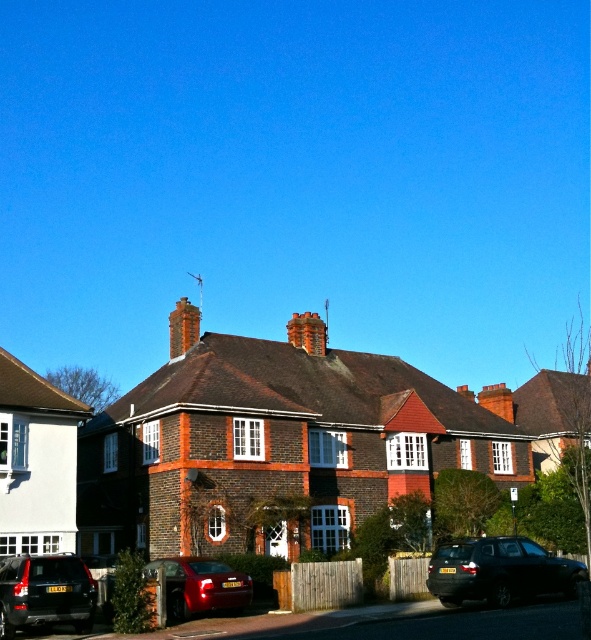
Is shiny black car at lower right to the right of brick chimney at center from the viewer's perspective?

Yes, shiny black car at lower right is to the right of brick chimney at center.

I want to click on shiny black car at lower right, so click(x=498, y=570).

At what (x,y) coordinates should I click in order to perform the action: click on shiny black car at lower right. Please return your answer as a coordinate pair (x, y). The height and width of the screenshot is (640, 591). Looking at the image, I should click on (498, 570).

Can you confirm if matte black suv at lower left is smaller than brick chimney at center?

Correct, matte black suv at lower left occupies less space than brick chimney at center.

Between point (34, 579) and point (170, 339), which one is positioned in front?

Point (34, 579) is more forward.

Image resolution: width=591 pixels, height=640 pixels. Describe the element at coordinates (46, 593) in the screenshot. I see `matte black suv at lower left` at that location.

Where is `matte black suv at lower left`? The width and height of the screenshot is (591, 640). matte black suv at lower left is located at coordinates (46, 593).

Which is more to the left, brick chimney at center or red brick chimney at center?

Positioned to the left is brick chimney at center.

Does brick chimney at center lie in front of red brick chimney at center?

Yes, brick chimney at center is in front of red brick chimney at center.

The width and height of the screenshot is (591, 640). Describe the element at coordinates (183, 326) in the screenshot. I see `brick chimney at center` at that location.

The image size is (591, 640). In order to click on brick chimney at center in this screenshot , I will do `click(183, 326)`.